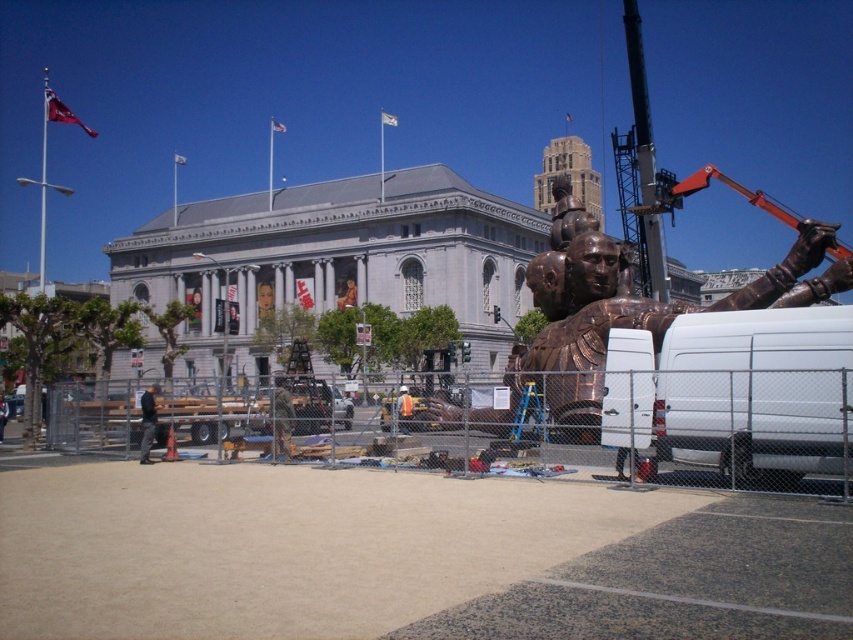
Question: Is the position of copper metallic statue at right less distant than that of black fabric jacket at center?

Choices:
 (A) no
 (B) yes

Answer: (B)

Question: Which point is farther to the camera?

Choices:
 (A) (155, 385)
 (B) (587, 392)

Answer: (A)

Question: Which point is closer to the camera?

Choices:
 (A) copper metallic statue at right
 (B) black fabric jacket at center

Answer: (A)

Question: Is copper metallic statue at right wider than black fabric jacket at center?

Choices:
 (A) yes
 (B) no

Answer: (A)

Question: Is copper metallic statue at right bigger than black fabric jacket at center?

Choices:
 (A) yes
 (B) no

Answer: (A)